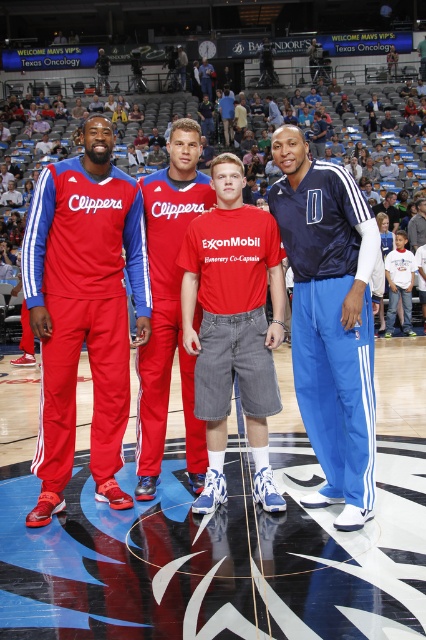
Is matte red tracksuit at center taller than matte red tracksuit at left?

Indeed, matte red tracksuit at center has a greater height compared to matte red tracksuit at left.

Is matte red tracksuit at center positioned behind matte red tracksuit at left?

No, it is not.

Who is more distant from viewer, [222,161] or [126,384]?

Point [126,384]

The image size is (426, 640). Find the location of `matte red tracksuit at center`. matte red tracksuit at center is located at coordinates pos(233,312).

Can you confirm if matte red tracksuit at center is thinner than red cotton t-shirt at center?

No.

Which of these two, matte red tracksuit at center or red cotton t-shirt at center, stands shorter?

Standing shorter between the two is red cotton t-shirt at center.

Locate an element on the screen. matte red tracksuit at center is located at coordinates (233, 312).

Identify the location of matte red tracksuit at center. (233, 312).

Does point (100, 330) come behind point (308, 225)?

Yes, it is behind point (308, 225).

Is point (37, 436) positioned in front of point (287, 205)?

That is False.

Between point (45, 266) and point (294, 259), which one is positioned behind?

Positioned behind is point (45, 266).

This screenshot has width=426, height=640. Find the location of `matte red tracksuit at left`. matte red tracksuit at left is located at coordinates (83, 307).